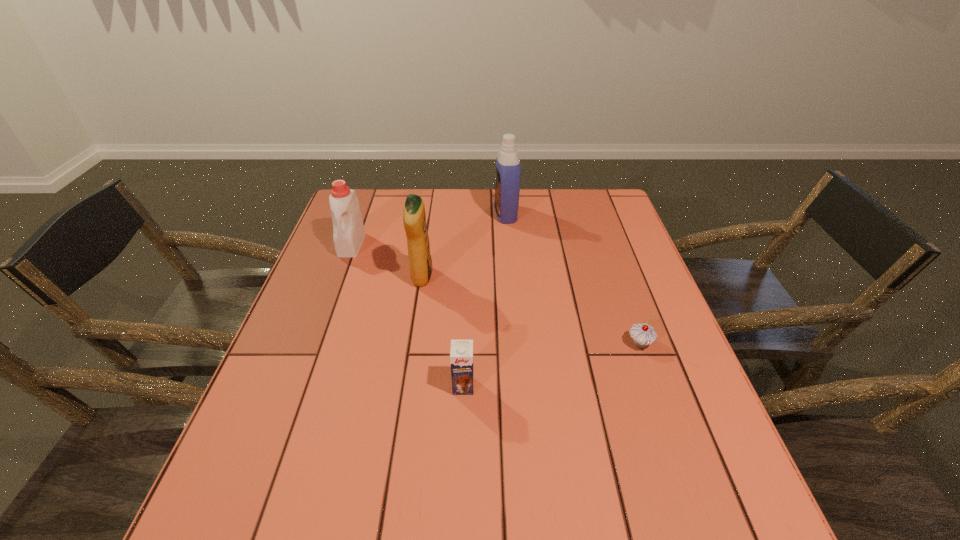
Locate an element on the screen. The height and width of the screenshot is (540, 960). vacant space located 0.380m on the front of the rightmost detergent is located at coordinates (514, 313).

Where is `vacant space located on the label of the nearest detergent`? The width and height of the screenshot is (960, 540). vacant space located on the label of the nearest detergent is located at coordinates click(451, 278).

Where is `free space located 0.180m on the handle side of the second farthest object`? free space located 0.180m on the handle side of the second farthest object is located at coordinates (330, 303).

Find the location of a particular element. The width and height of the screenshot is (960, 540). free spot located 0.060m on the front label of the chocolate milk is located at coordinates (462, 421).

Locate an element on the screen. Image resolution: width=960 pixels, height=540 pixels. vacant area situated on the left of the rightmost object is located at coordinates (566, 343).

In order to click on object that is at the far edge in this screenshot , I will do `click(507, 187)`.

Identify the location of object at the left edge. This screenshot has height=540, width=960. (348, 230).

The height and width of the screenshot is (540, 960). I want to click on object at the right edge, so click(643, 334).

In the image, there is a desktop. Identify the location of free space at the far edge. The width and height of the screenshot is (960, 540). (481, 225).

Image resolution: width=960 pixels, height=540 pixels. Find the location of `blank space at the near edge`. blank space at the near edge is located at coordinates (523, 496).